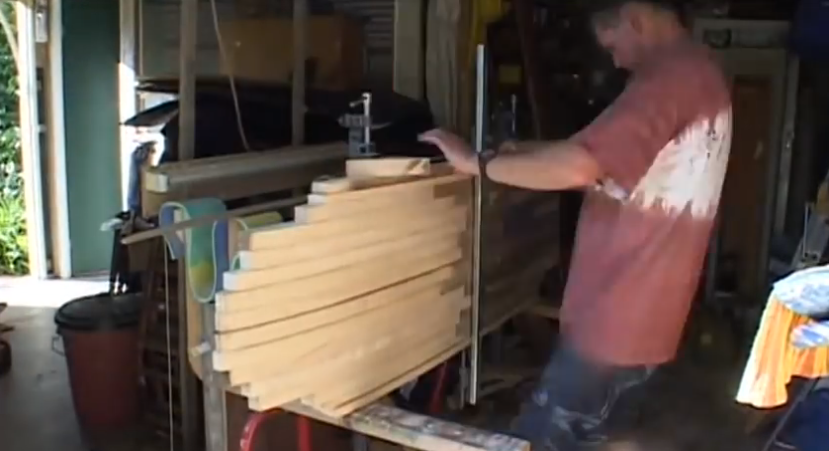
This screenshot has width=829, height=451. I want to click on workbench, so tap(211, 398).